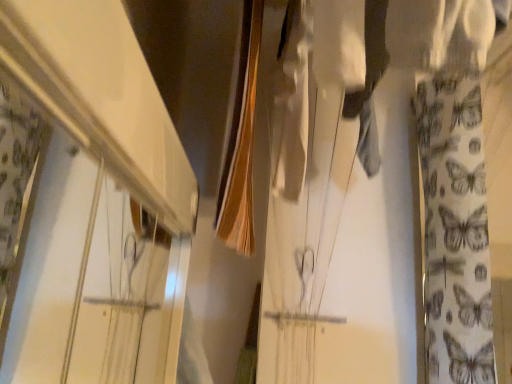
Question: Is white glossy shelf at upper left smaller than white fabric with butterfly pattern at right?

Choices:
 (A) yes
 (B) no

Answer: (A)

Question: Would you say white glossy shelf at upper left is a long distance from white fabric with butterfly pattern at right?

Choices:
 (A) no
 (B) yes

Answer: (A)

Question: Is white fabric with butterfly pattern at right a part of white glossy shelf at upper left?

Choices:
 (A) yes
 (B) no

Answer: (B)

Question: Considering the relative sizes of white glossy shelf at upper left and white fabric with butterfly pattern at right in the image provided, is white glossy shelf at upper left taller than white fabric with butterfly pattern at right?

Choices:
 (A) yes
 (B) no

Answer: (B)

Question: Is white glossy shelf at upper left not inside white fabric with butterfly pattern at right?

Choices:
 (A) yes
 (B) no

Answer: (A)

Question: From a real-world perspective, relative to white fabric with butterfly pattern at right, is smooth brown fabric at center vertically above or below?

Choices:
 (A) above
 (B) below

Answer: (A)

Question: From the image's perspective, is smooth brown fabric at center positioned above or below white fabric with butterfly pattern at right?

Choices:
 (A) above
 (B) below

Answer: (A)

Question: From their relative heights in the image, would you say smooth brown fabric at center is taller or shorter than white fabric with butterfly pattern at right?

Choices:
 (A) tall
 (B) short

Answer: (B)

Question: Visually, is smooth brown fabric at center positioned to the left or to the right of white fabric with butterfly pattern at right?

Choices:
 (A) right
 (B) left

Answer: (B)

Question: Would you say white fabric with butterfly pattern at right is inside or outside smooth brown fabric at center?

Choices:
 (A) outside
 (B) inside

Answer: (A)

Question: Is white fabric with butterfly pattern at right wider or thinner than smooth brown fabric at center?

Choices:
 (A) wide
 (B) thin

Answer: (A)

Question: Considering their positions, is white fabric with butterfly pattern at right located in front of or behind smooth brown fabric at center?

Choices:
 (A) behind
 (B) front

Answer: (A)

Question: Is point (489, 334) positioned closer to the camera than point (238, 210)?

Choices:
 (A) closer
 (B) farther

Answer: (B)

Question: Considering the positions of white glossy shelf at upper left and smooth brown fabric at center in the image, is white glossy shelf at upper left wider or thinner than smooth brown fabric at center?

Choices:
 (A) thin
 (B) wide

Answer: (B)

Question: From the image's perspective, is white glossy shelf at upper left positioned above or below smooth brown fabric at center?

Choices:
 (A) above
 (B) below

Answer: (B)